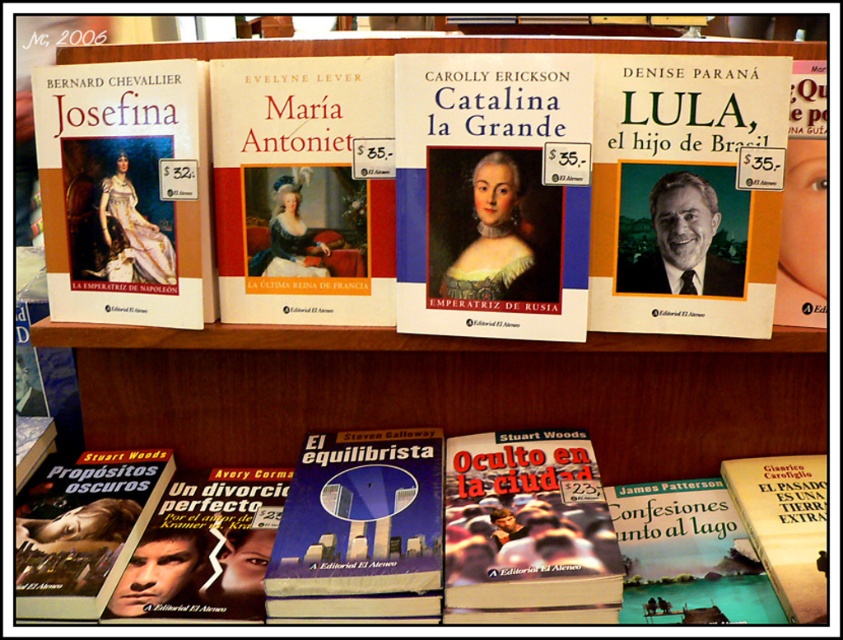
Question: Among these points, which one is nearest to the camera?

Choices:
 (A) (620, 145)
 (B) (339, 257)
 (C) (313, 573)

Answer: (C)

Question: Can you confirm if matte white book at center is smaller than matte gold book at upper left?

Choices:
 (A) yes
 (B) no

Answer: (A)

Question: Does blue hardcover book at center have a greater width compared to hardcover book at lower right?

Choices:
 (A) no
 (B) yes

Answer: (B)

Question: Estimate the real-world distances between objects in this image. Which object is farther from the matte paper cover at upper center?

Choices:
 (A) matte black book at upper right
 (B) blue hardcover book at center
 (C) matte white book at upper left

Answer: (A)

Question: Can you confirm if matte white book at center is positioned to the right of matte paper cover at upper center?

Choices:
 (A) no
 (B) yes

Answer: (B)

Question: Which object is positioned closest to the hardcover book at lower right?

Choices:
 (A) matte gold book at upper left
 (B) matte white book at upper left
 (C) matte black book at upper right
 (D) matte white book at center

Answer: (C)